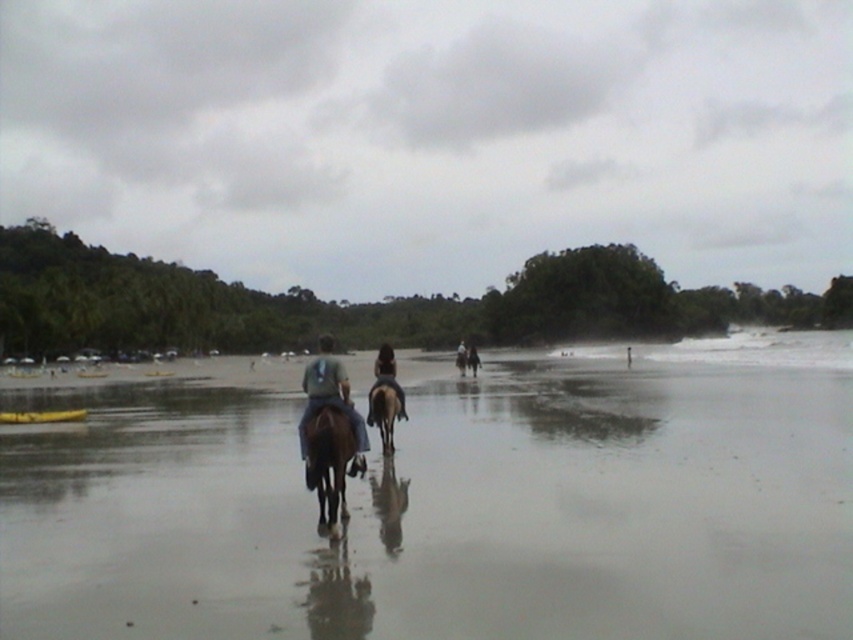
You are standing at the point marked by the coordinates point (457,508) in the beach scene. What surface are you currently standing on?

The point (457,508) indicates shiny wet sand at center, so you are standing on shiny wet sand.

You are a photographer standing on the beach and want to capture a photo of the dark brown leather horse at center and the blue denim jeans at center. Based on their positions, which object should you adjust your camera to focus on first to ensure both are in the frame?

The dark brown leather horse at center should be focused on first since the blue denim jeans at center is to the right of it, allowing you to adjust the camera to include both in the frame by panning right.